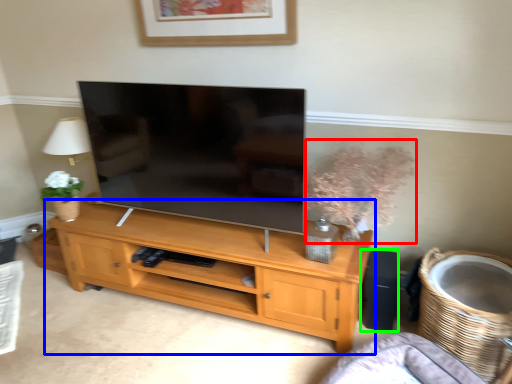
Question: Based on their relative distances, which object is farther from floral arrangement (highlighted by a red box)? Choose from shelf (highlighted by a blue box) and speaker (highlighted by a green box).

Choices:
 (A) shelf
 (B) speaker

Answer: (A)